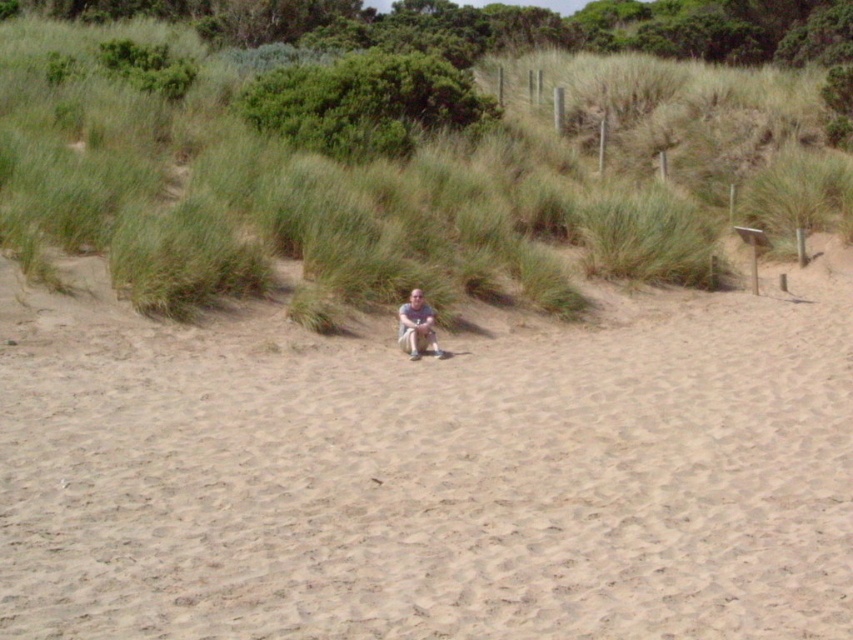
You are a photographer trying to capture a wide shot of the beige sandy beach at center and the light brown fabric pants at center. Which object will appear wider in the photo?

The beige sandy beach at center will appear wider in the photo since its width surpasses that of the light brown fabric pants at center.

You are standing at the point marked by coordinates point (431,470) on the sandy beach. Looking towards the dense green vegetation in the background, which direction should you walk to reach the vegetation?

The dense green vegetation is located in the background behind the beige sandy beach at center, so walking forward from the point (431,470) would lead towards the vegetation.